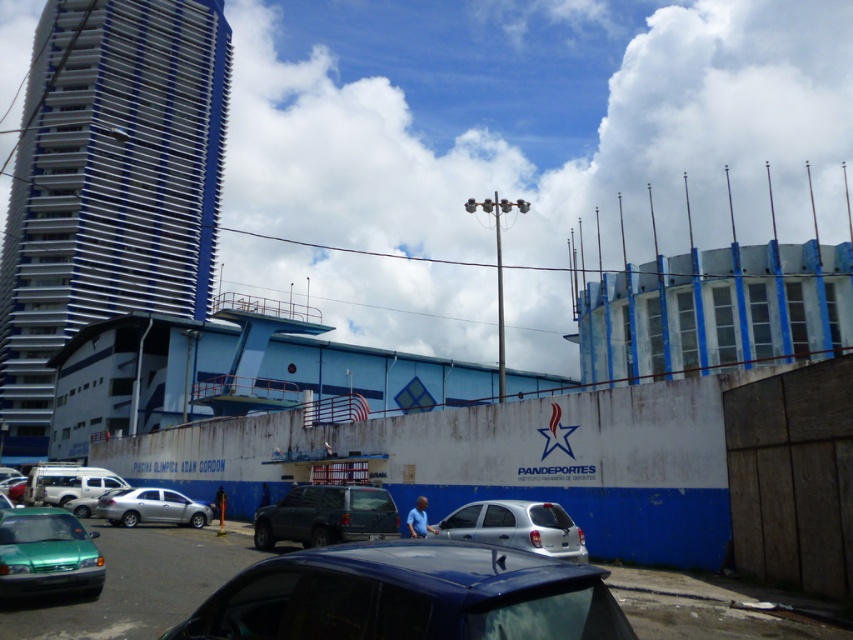
You are a delivery person trying to park your van in the parking lot. You see the glossy blue car at center and the silver metallic car at lower left. Which car is taller, and does this affect your parking space choice?

The glossy blue car at center is taller than the silver metallic car at lower left. This means the glossy blue car at center may require more vertical space, so you should choose a parking spot that accommodates its height to avoid damage.

From the picture: You are a delivery person trying to park your van in the parking lot. You see the glossy blue car at center and the silver metallic car at lower left. Which car is positioned higher up in the image?

The glossy blue car at center is located above the silver metallic car at lower left, so it is positioned higher up in the image.

You are standing in the parking lot and want to walk from point point (x=25, y=445) to point (x=76, y=506). Which direction should you face to move towards the correct point?

To move from point (x=25, y=445) to point (x=76, y=506), you should face towards the lower right direction since point (x=76, y=506) is further away from the camera compared to point (x=25, y=445).